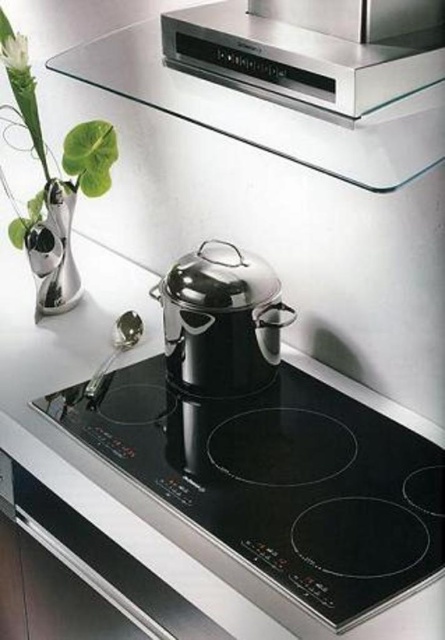
Question: Estimate the real-world distances between objects in this image. Which object is closer to the polished stainless steel pot at center?

Choices:
 (A) silver metallic vase at left
 (B) satin silver range hood at upper center
 (C) black glass cooktop at center
 (D) white matte flower at upper left

Answer: (C)

Question: Considering the relative positions of black glass cooktop at center and silver metallic vase at left in the image provided, where is black glass cooktop at center located with respect to silver metallic vase at left?

Choices:
 (A) right
 (B) left

Answer: (A)

Question: Considering the real-world distances, which object is closest to the silver metallic vase at left?

Choices:
 (A) satin silver range hood at upper center
 (B) black glass cooktop at center
 (C) green leafy plant at left
 (D) white matte flower at upper left

Answer: (C)

Question: Is satin silver range hood at upper center bigger than green leafy plant at left?

Choices:
 (A) yes
 (B) no

Answer: (B)

Question: Which object appears closest to the camera in this image?

Choices:
 (A) polished stainless steel pot at center
 (B) black glass cooktop at center
 (C) silver metallic vase at left
 (D) white matte flower at upper left

Answer: (B)

Question: Can you confirm if polished stainless steel pot at center is positioned to the left of silver metallic vase at left?

Choices:
 (A) no
 (B) yes

Answer: (A)